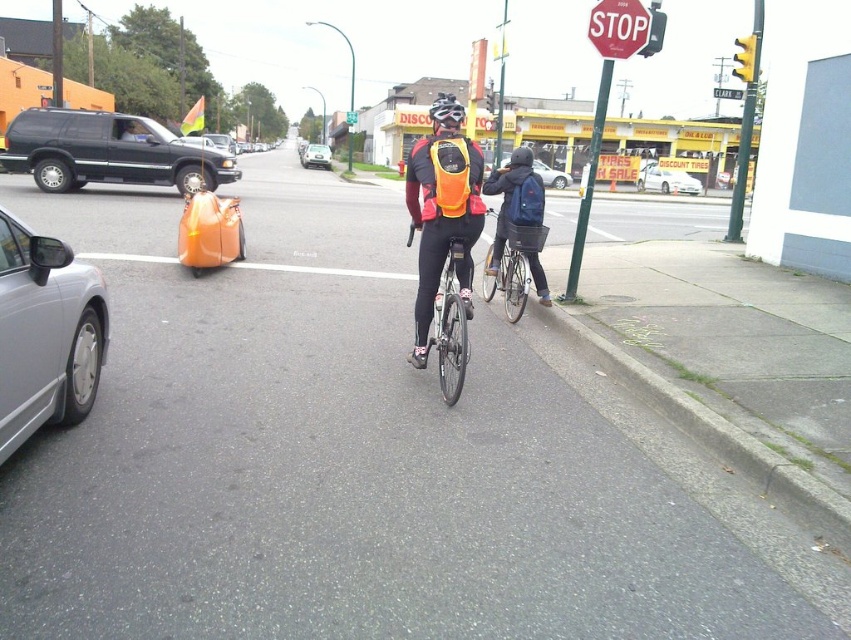
You are a delivery person who needs to carry a package that is 20 inches wide. You have a shiny metallic bicycle at center and a dark blue backpack at center. Which item can you use to carry the package without the package exceeding its width?

The dark blue backpack at center has a greater width than the shiny metallic bicycle at center, so the package can be placed in the dark blue backpack at center as it can accommodate the 20 inches width.

Looking at this image, what are the coordinates of the white glossy sedan at center?

The white glossy sedan at center is located at coordinates point (667, 180).

You are a delivery driver who needs to pass through the area where the white glossy sedan at center and the black matte bicycle helmet at center are located. Which object should you avoid hitting because it is closer to your vehicle?

The black matte bicycle helmet at center is closer to your vehicle because it has a smaller size compared to the white glossy sedan at center.